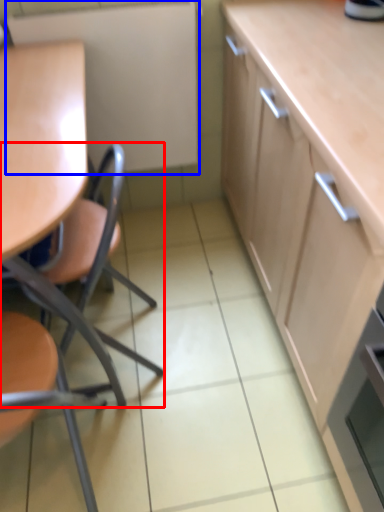
Question: Among these objects, which one is farthest to the camera, chair (highlighted by a red box) or appliance (highlighted by a blue box)?

Choices:
 (A) chair
 (B) appliance

Answer: (B)